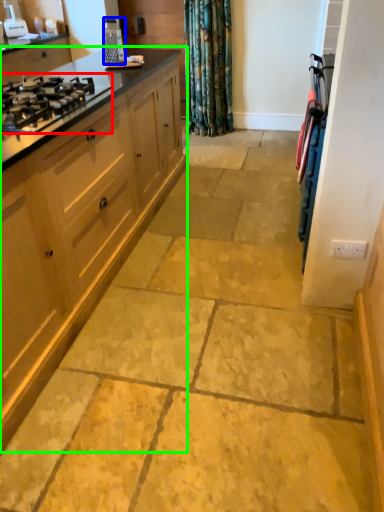
Question: Which is farther away from gas stove (highlighted by a red box)? appliance (highlighted by a blue box) or cabinetry (highlighted by a green box)?

Choices:
 (A) appliance
 (B) cabinetry

Answer: (A)